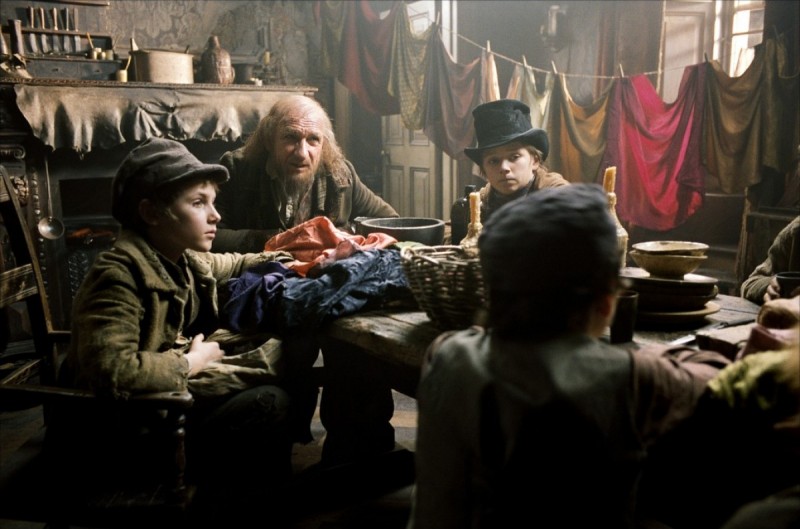
Find the location of `mantel`. mantel is located at coordinates click(190, 100).